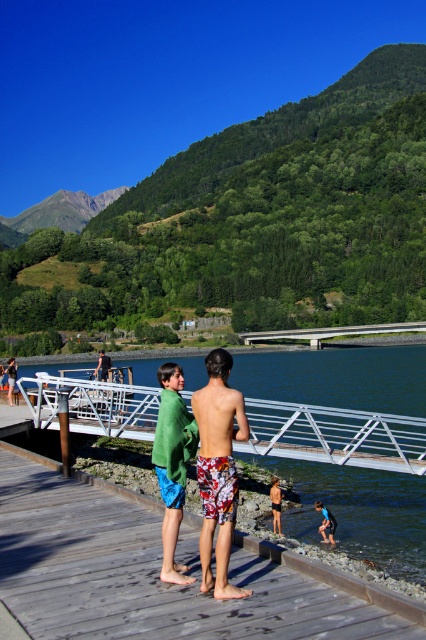
Is wooden dock at center below shiny metallic pole at center?

No.

Which is behind, point (319, 586) or point (95, 371)?

Point (95, 371)

The height and width of the screenshot is (640, 426). What do you see at coordinates (149, 576) in the screenshot?
I see `wooden dock at center` at bounding box center [149, 576].

You are a GUI agent. You are given a task and a screenshot of the screen. Output one action in this format:
    pyautogui.click(x=<x>, y=<y>)
    Task: Click on the wooden dock at center
    The image size is (426, 640).
    Given the screenshot: What is the action you would take?
    pyautogui.click(x=149, y=576)

Does wooden dock at center appear on the left side of green towel at center?

In fact, wooden dock at center is to the right of green towel at center.

Locate an element on the screen. The width and height of the screenshot is (426, 640). wooden dock at center is located at coordinates (149, 576).

In order to click on wooden dock at center in this screenshot , I will do `click(149, 576)`.

Does blue swim trunks at lower right appear under shiny metallic pole at center?

No, blue swim trunks at lower right is not below shiny metallic pole at center.

Between point (322, 520) and point (106, 371), which one is positioned behind?

The point (106, 371) is behind.

Which is behind, point (330, 522) or point (98, 368)?

The point (98, 368) is more distant.

This screenshot has height=640, width=426. Identify the location of blue swim trunks at lower right. (325, 522).